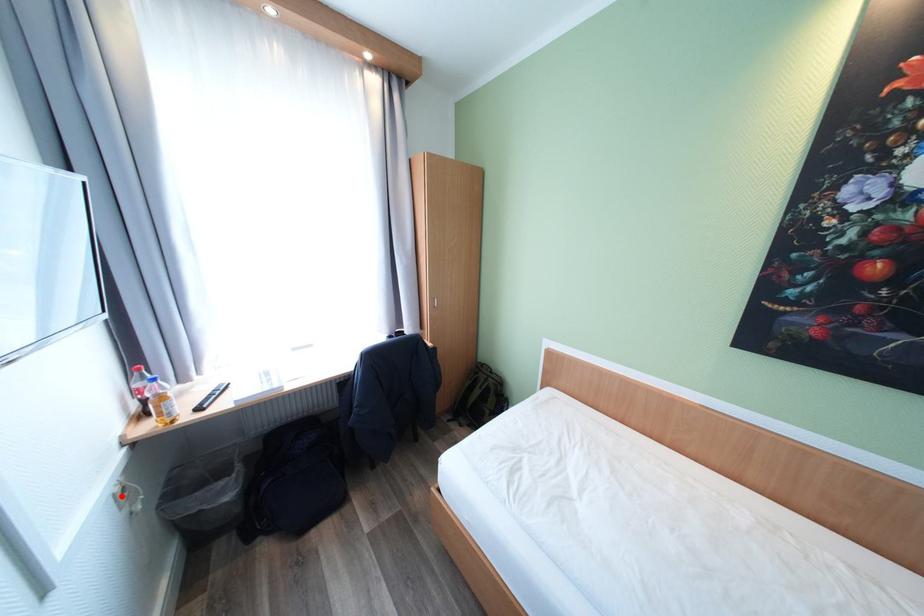
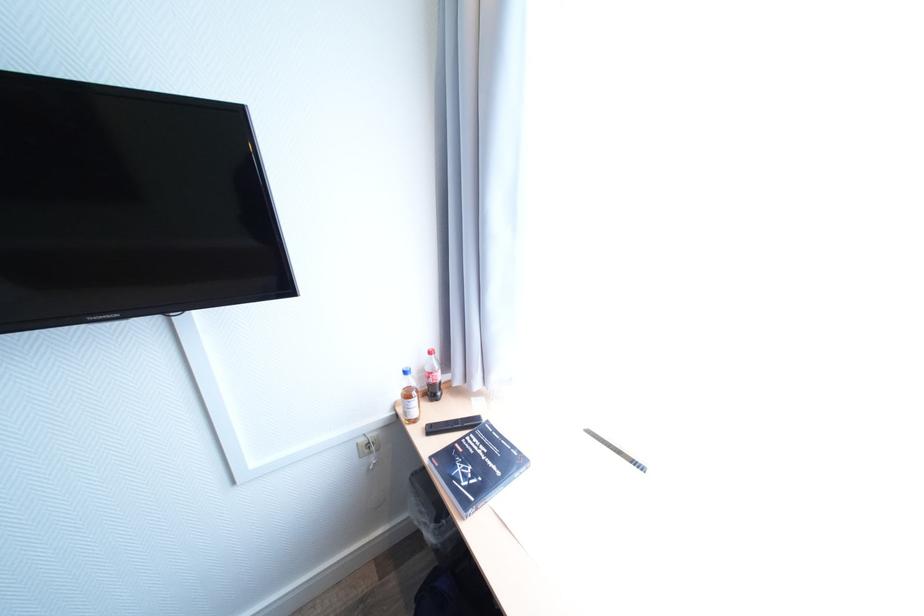
Question: I am providing you with two images of the same scene from different viewpoints. A red point is shown in image1. For the corresponding object point in image2, is it positioned nearer or farther from the camera?

Choices:
 (A) Nearer
 (B) Farther

Answer: (A)